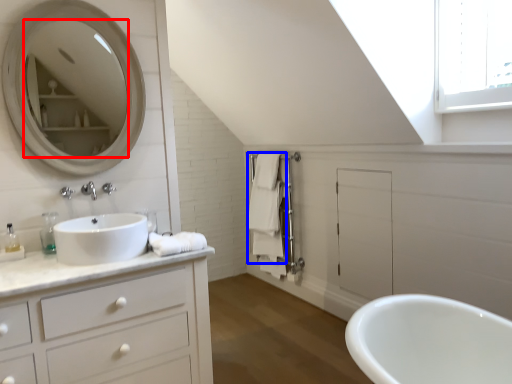
Question: Which object appears closest to the camera in this image, mirror (highlighted by a red box) or bath towel (highlighted by a blue box)?

Choices:
 (A) mirror
 (B) bath towel

Answer: (A)